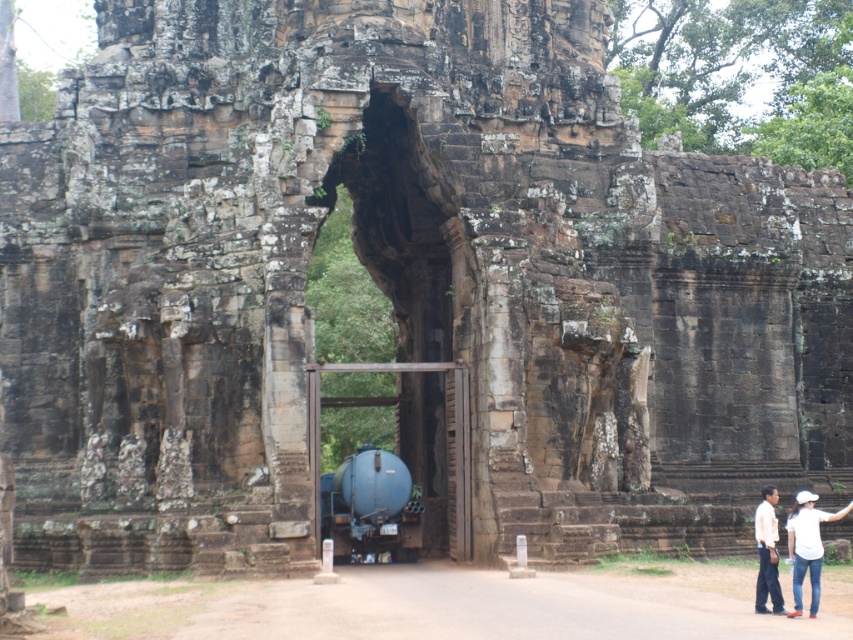
Based on the photo, you are a photographer standing in front of the ancient stone structure. You want to capture both the blue metallic tank at center and the white shirt at lower right in the same frame. Which object should you focus on first to ensure both are in focus?

The blue metallic tank at center is much taller than the white shirt at lower right, so focusing on the blue metallic tank at center first will help ensure both are in focus since it is farther away and occupies more space in the frame.

You are an archaeologist standing in front of the ancient stone structure. You notice the blue metallic tank at center and the white shirt at lower right. Which object is closer to you?

The blue metallic tank at center is positioned over the white shirt at lower right, meaning it is closer to you.